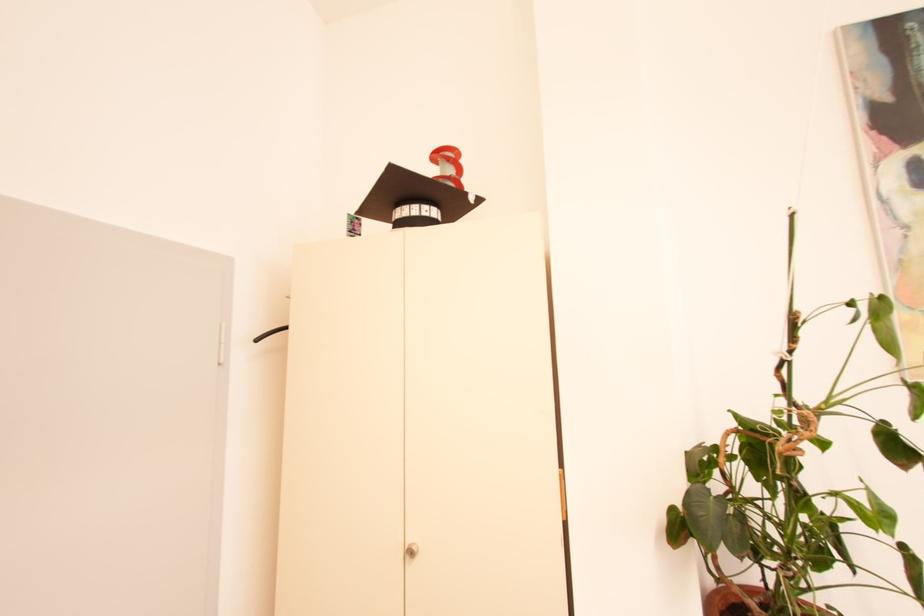
Where would you turn the cabinet lock? Please return your answer as a coordinate pair (x, y).

(407, 565)